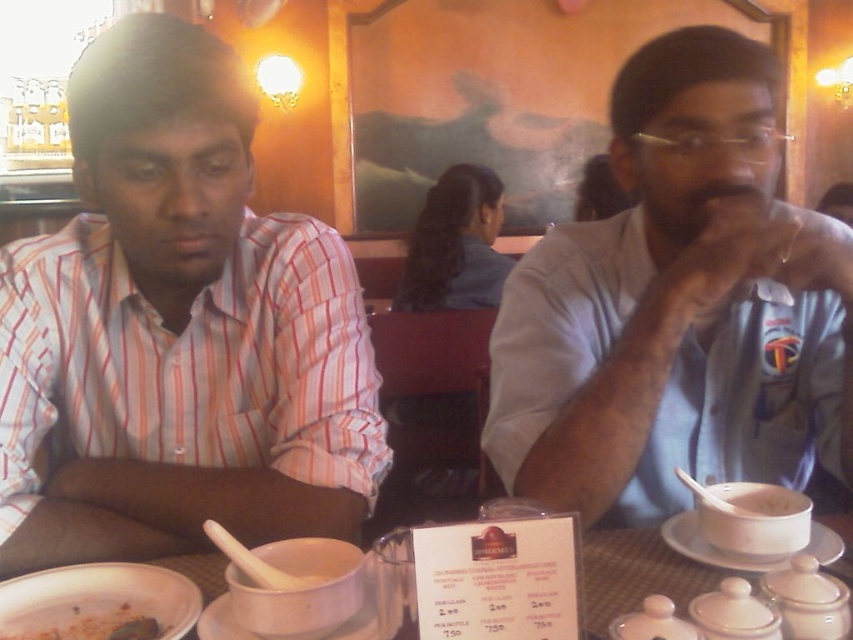
From the picture: Which of these two, white paper menu at center or brown matte bowl at lower left, stands taller?

With more height is white paper menu at center.

Does white paper menu at center have a smaller size compared to brown matte bowl at lower left?

No.

Does point (448, 548) come farther from viewer compared to point (32, 636)?

No.

You are a GUI agent. You are given a task and a screenshot of the screen. Output one action in this format:
    pyautogui.click(x=<x>, y=<y>)
    Task: Click on the white paper menu at center
    
    Given the screenshot: What is the action you would take?
    pyautogui.click(x=498, y=579)

Can you confirm if light blue shirt at center is bigger than white paper menu at center?

Correct, light blue shirt at center is larger in size than white paper menu at center.

Is light blue shirt at center thinner than white paper menu at center?

In fact, light blue shirt at center might be wider than white paper menu at center.

Where is `light blue shirt at center`? light blue shirt at center is located at coordinates (677, 307).

Between white paper menu at center and white matte rice at right, which one appears on the right side from the viewer's perspective?

white matte rice at right is more to the right.

Is point (460, 636) positioned after point (773, 515)?

No.

Locate an element on the screen. The image size is (853, 640). white paper menu at center is located at coordinates (498, 579).